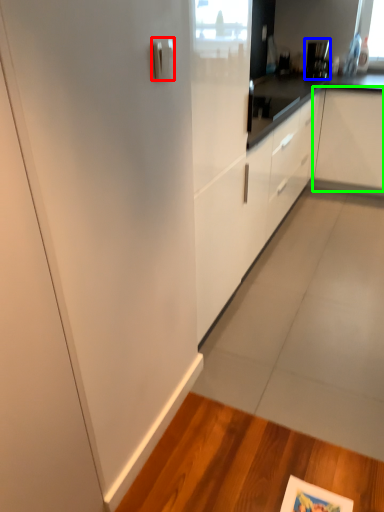
Question: Which is nearer to the door handle (highlighted by a red box)? appliance (highlighted by a blue box) or cabinetry (highlighted by a green box).

Choices:
 (A) appliance
 (B) cabinetry

Answer: (B)